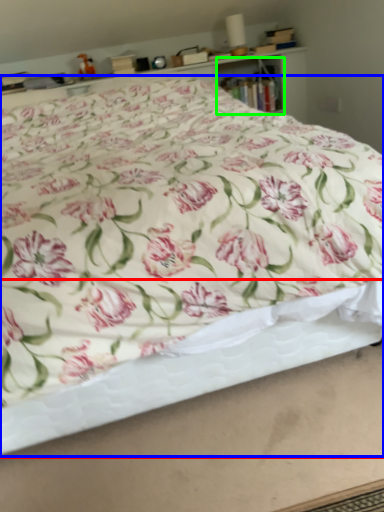
Question: Which object is positioned closest to bed frame (highlighted by a red box)? Select from bed (highlighted by a blue box) and cabinet (highlighted by a green box).

Choices:
 (A) bed
 (B) cabinet

Answer: (A)